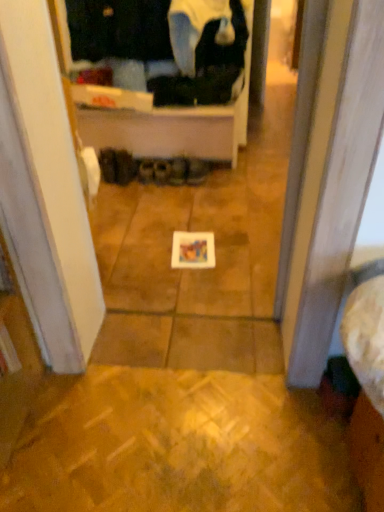
Question: Which direction should I rotate to face brown suede shoes at center, which ranks as the third footwear in right-to-left order, — up or down?

Choices:
 (A) down
 (B) up

Answer: (B)

Question: From the image's perspective, does brown suede boot at center, which appears as the fifth footwear when viewed from the right, appear lower than brown suede shoes at center, which ranks as the third footwear in right-to-left order?

Choices:
 (A) no
 (B) yes

Answer: (A)

Question: Considering the relative positions of brown suede boot at center, which appears as the fifth footwear when viewed from the right, and brown suede shoes at center, which ranks as the third footwear in right-to-left order, in the image provided, is brown suede boot at center, which appears as the fifth footwear when viewed from the right, to the left of brown suede shoes at center, which ranks as the third footwear in right-to-left order, from the viewer's perspective?

Choices:
 (A) no
 (B) yes

Answer: (B)

Question: Is brown suede boot at center, the 2th footwear in the left-to-right sequence, taller than brown suede shoes at center, which ranks as the fourth footwear in left-to-right order?

Choices:
 (A) no
 (B) yes

Answer: (B)

Question: Can you confirm if brown suede boot at center, which appears as the fifth footwear when viewed from the right, is wider than brown suede shoes at center, which ranks as the third footwear in right-to-left order?

Choices:
 (A) no
 (B) yes

Answer: (B)

Question: Is brown suede shoes at center, which ranks as the third footwear in right-to-left order, surrounded by brown suede boot at center, the 2th footwear in the left-to-right sequence?

Choices:
 (A) yes
 (B) no

Answer: (B)

Question: Does brown suede boot at center, which appears as the fifth footwear when viewed from the right, come in front of brown suede shoes at center, which ranks as the fourth footwear in left-to-right order?

Choices:
 (A) no
 (B) yes

Answer: (B)

Question: Does black fabric at upper center contain black fabric shoes at center, which is counted as the sixth footwear, starting from the right?

Choices:
 (A) no
 (B) yes

Answer: (A)

Question: Considering the relative sizes of black fabric at upper center and black fabric shoes at center, which is counted as the sixth footwear, starting from the right, in the image provided, is black fabric at upper center wider than black fabric shoes at center, which is counted as the sixth footwear, starting from the right,?

Choices:
 (A) yes
 (B) no

Answer: (A)

Question: Is black fabric at upper center facing away from black fabric shoes at center, marked as the 1th footwear in a left-to-right arrangement?

Choices:
 (A) yes
 (B) no

Answer: (B)

Question: Is black fabric at upper center to the right of black fabric shoes at center, marked as the 1th footwear in a left-to-right arrangement, from the viewer's perspective?

Choices:
 (A) no
 (B) yes

Answer: (B)

Question: Is black fabric at upper center positioned before black fabric shoes at center, marked as the 1th footwear in a left-to-right arrangement?

Choices:
 (A) yes
 (B) no

Answer: (A)

Question: Considering the relative positions of black fabric at upper center and black fabric shoes at center, marked as the 1th footwear in a left-to-right arrangement, in the image provided, is black fabric at upper center to the left of black fabric shoes at center, marked as the 1th footwear in a left-to-right arrangement, from the viewer's perspective?

Choices:
 (A) yes
 (B) no

Answer: (B)

Question: Considering the relative sizes of black fabric shoes at center, marked as the 1th footwear in a left-to-right arrangement, and leather brown shoes at center, the sixth footwear from the left, in the image provided, is black fabric shoes at center, marked as the 1th footwear in a left-to-right arrangement, smaller than leather brown shoes at center, the sixth footwear from the left,?

Choices:
 (A) yes
 (B) no

Answer: (B)